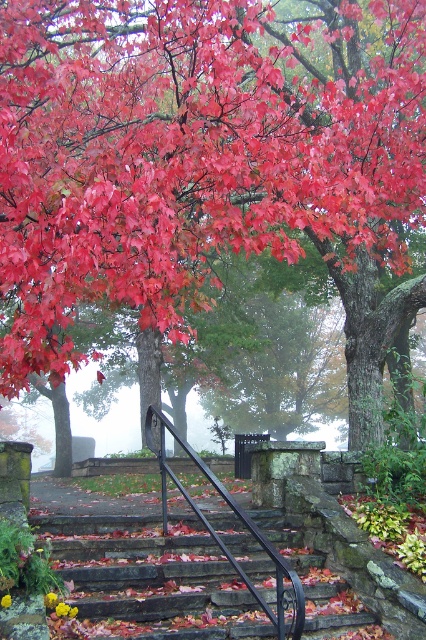
Is stone steps at center behind black metal/rail at center?

That is True.

Measure the distance between stone steps at center and black metal/rail at center.

stone steps at center and black metal/rail at center are 24.42 inches apart.

Locate an element on the screen. stone steps at center is located at coordinates (147, 580).